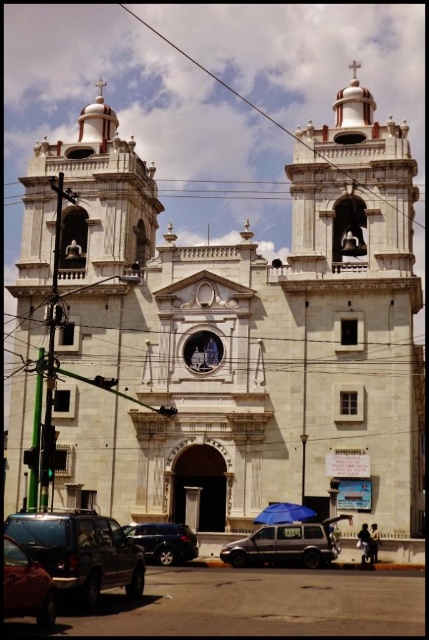
You are standing in front of the historic church. There is a point marked at coordinates [329,540] on the facade. If you want to reach this point, which direction should you move relative to your current position?

The point at [329,540] is 59.29 meters away from you, so you should move forward towards the church facade to reach it.

Based on the photo, you are a photographer standing in front of the historic church. You need to position yourself so that both the shiny black car at lower left and the satin black car at lower left are visible in your shot. Which car should you position closer to the camera to ensure both are fully visible?

The shiny black car at lower left is taller than the satin black car at lower left. To ensure both cars are fully visible in the shot, position the taller shiny black car at lower left closer to the camera so that the shorter satin black car at lower left can be seen in full without being blocked by the taller car.

You are a parking attendant and need to fit both the shiny black car at lower left and the satin black car at lower left into a parking spot that is 2 meters wide. Can both cars fit side by side in the spot?

The shiny black car at lower left has a lesser width compared to the satin black car at lower left. Since the total width of both cars combined is not provided, it is impossible to determine if they can fit into a 2 meter wide parking spot.